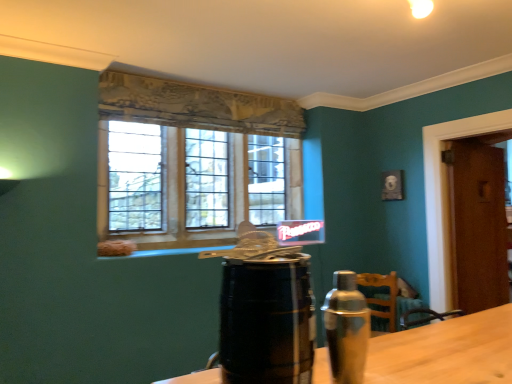
Question: Is black wooden barrel at center bigger or smaller than clear glass window at center?

Choices:
 (A) small
 (B) big

Answer: (A)

Question: Is black wooden barrel at center wider or thinner than clear glass window at center?

Choices:
 (A) wide
 (B) thin

Answer: (B)

Question: Which object is positioned closest to the clear glass window at center?

Choices:
 (A) silver metallic shaker at right
 (B) black wooden barrel at center
 (C) brown wooden door at right

Answer: (C)

Question: Which is nearer to the clear glass window at center?

Choices:
 (A) black wooden barrel at center
 (B) brown wooden door at right
 (C) silver metallic shaker at right

Answer: (B)